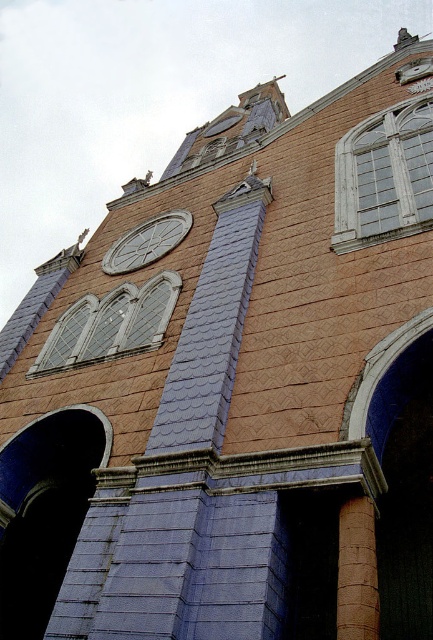
What do you see at coordinates (110, 323) in the screenshot? This screenshot has width=433, height=640. I see `clear glass windows at center` at bounding box center [110, 323].

Does clear glass windows at center appear on the right side of matte gray clock at upper center?

No, clear glass windows at center is not to the right of matte gray clock at upper center.

Where is `clear glass windows at center`? The width and height of the screenshot is (433, 640). clear glass windows at center is located at coordinates (110, 323).

Locate an element on the screen. This screenshot has height=640, width=433. clear glass windows at center is located at coordinates tap(110, 323).

Between white wooden window at upper right and matte gray clock at upper center, which one has more height?

Standing taller between the two is white wooden window at upper right.

What do you see at coordinates (384, 177) in the screenshot? The width and height of the screenshot is (433, 640). I see `white wooden window at upper right` at bounding box center [384, 177].

Which is in front, point (394, 157) or point (141, 237)?

Point (394, 157) is more forward.

This screenshot has width=433, height=640. Find the location of `white wooden window at upper right`. white wooden window at upper right is located at coordinates (384, 177).

Does white wooden window at upper right appear on the left side of clear glass windows at center?

Incorrect, white wooden window at upper right is not on the left side of clear glass windows at center.

Can you confirm if white wooden window at upper right is bigger than clear glass windows at center?

Yes, white wooden window at upper right is bigger than clear glass windows at center.

Is point (355, 145) positioned in front of point (115, 308)?

No, it is not.

Identify the location of white wooden window at upper right. (384, 177).